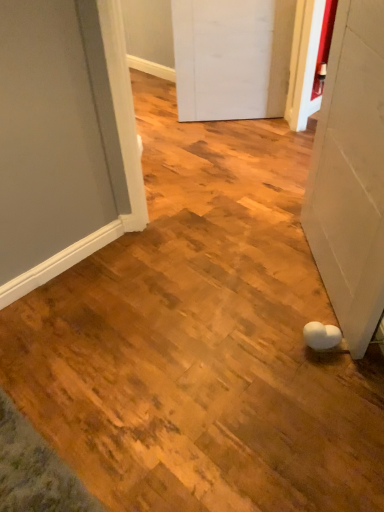
Where is `vacant area situated to the left side of white matte door at center, which ranks as the 2th door in bottom-to-top order`? Image resolution: width=384 pixels, height=512 pixels. vacant area situated to the left side of white matte door at center, which ranks as the 2th door in bottom-to-top order is located at coordinates (182, 124).